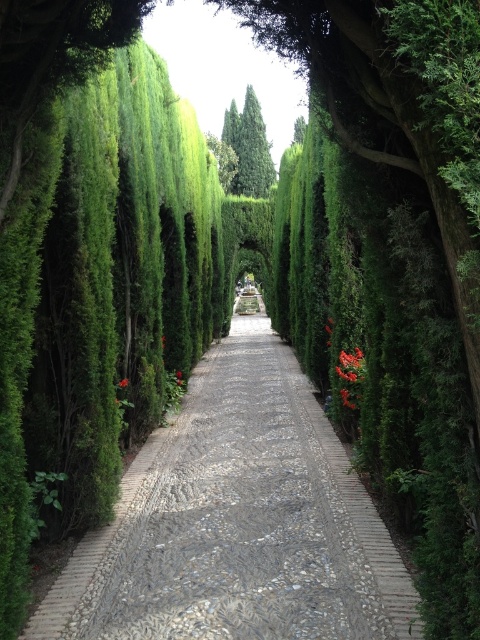
Question: Is green textured stone alley at center to the right of bright red berries at center from the viewer's perspective?

Choices:
 (A) yes
 (B) no

Answer: (B)

Question: Based on their relative distances, which object is farther from the green textured stone alley at center?

Choices:
 (A) red matte flower at center
 (B) bright red berries at center
 (C) green leafy tree at center
 (D) orange matte flower at center

Answer: (C)

Question: Which point is farther from the camera taking this photo?

Choices:
 (A) (128, 381)
 (B) (165, 346)
 (C) (227, 125)

Answer: (C)

Question: Can you confirm if bright red berries at center is positioned below red matte flower at center?

Choices:
 (A) yes
 (B) no

Answer: (A)

Question: Which object is positioned farthest from the green leafy tree at center?

Choices:
 (A) red matte flower at center
 (B) orange matte flower at center

Answer: (B)

Question: Does green textured stone alley at center have a larger size compared to orange matte flower at center?

Choices:
 (A) no
 (B) yes

Answer: (B)